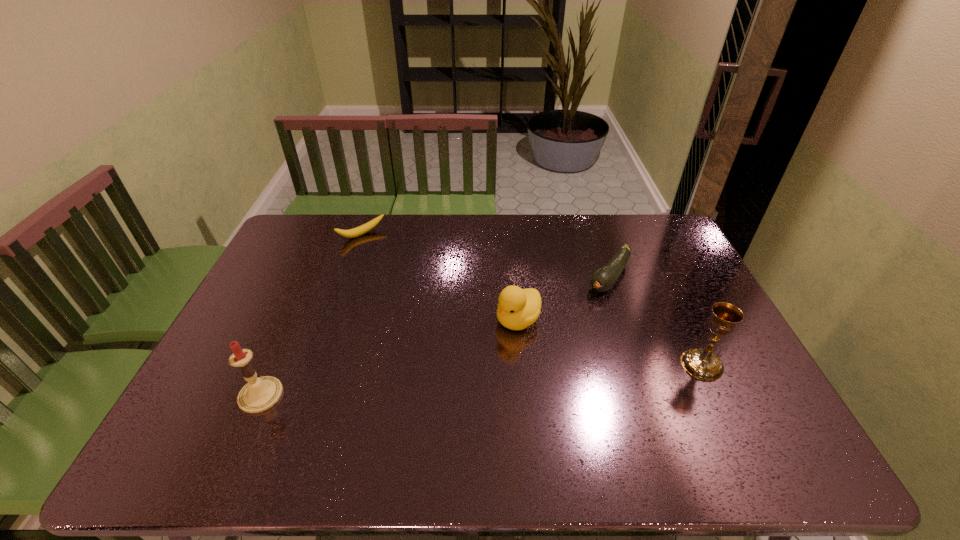
Identify the location of free space that satisfies the following two spatial constraints: 1. on the front side of the third nearest object; 2. on the right side of the banana. point(332,320).

The width and height of the screenshot is (960, 540). Identify the location of free point that satisfies the following two spatial constraints: 1. on the back side of the zucchini; 2. on the right side of the candle. (312, 277).